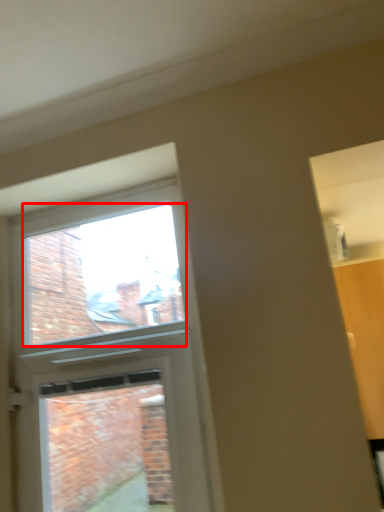
Question: From the image's perspective, what is the correct spatial positioning of window screen (annotated by the red box) in reference to screen door?

Choices:
 (A) above
 (B) below

Answer: (A)